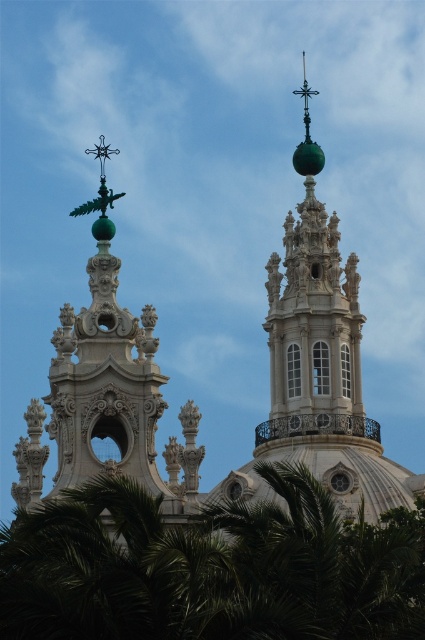
Question: Is the position of green leafy tree at lower left less distant than that of green polished dome at upper left?

Choices:
 (A) no
 (B) yes

Answer: (B)

Question: Which of the following is the closest to the observer?

Choices:
 (A) green leafy tree at lower left
 (B) green polished dome at upper left

Answer: (A)

Question: Which point is closer to the camera?

Choices:
 (A) green polished dome at upper left
 (B) green leafy tree at lower left

Answer: (B)

Question: Is green leafy tree at lower left smaller than green polished dome at upper left?

Choices:
 (A) no
 (B) yes

Answer: (A)

Question: Is green leafy tree at lower left to the left of green polished dome at upper left from the viewer's perspective?

Choices:
 (A) no
 (B) yes

Answer: (A)